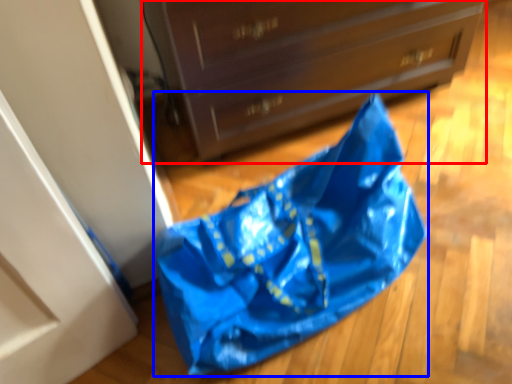
Question: Which of the following is the closest to the observer, chest of drawers (highlighted by a red box) or grocery bag (highlighted by a blue box)?

Choices:
 (A) chest of drawers
 (B) grocery bag

Answer: (B)